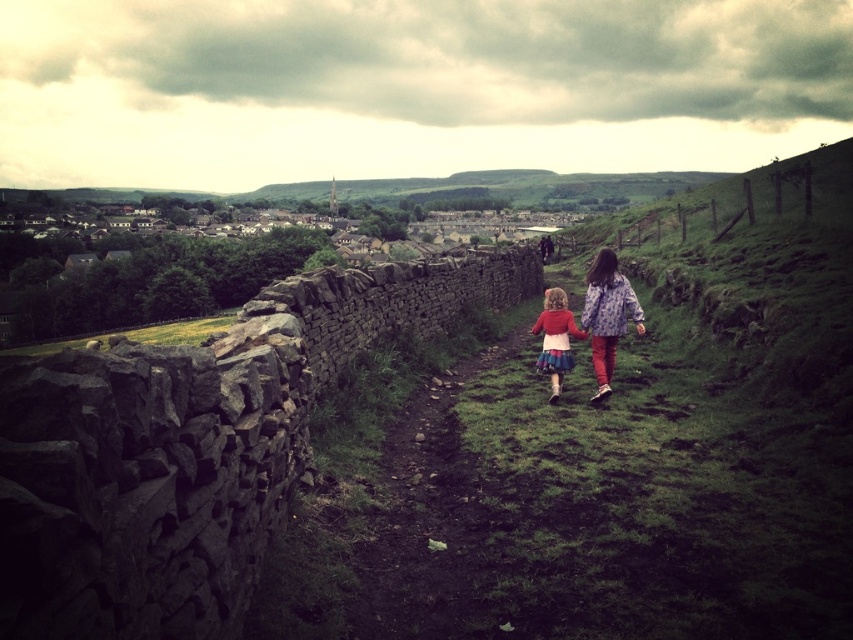
Question: Which object appears farthest from the camera in this image?

Choices:
 (A) matte red sweater at center
 (B) floral fabric jacket at right

Answer: (A)

Question: Can you confirm if floral fabric jacket at right is smaller than matte red sweater at center?

Choices:
 (A) yes
 (B) no

Answer: (B)

Question: Is the position of floral fabric jacket at right more distant than that of matte red sweater at center?

Choices:
 (A) yes
 (B) no

Answer: (B)

Question: Can you confirm if floral fabric jacket at right is positioned below matte red sweater at center?

Choices:
 (A) yes
 (B) no

Answer: (B)

Question: Which point is closer to the camera taking this photo?

Choices:
 (A) (558, 300)
 (B) (593, 342)

Answer: (B)